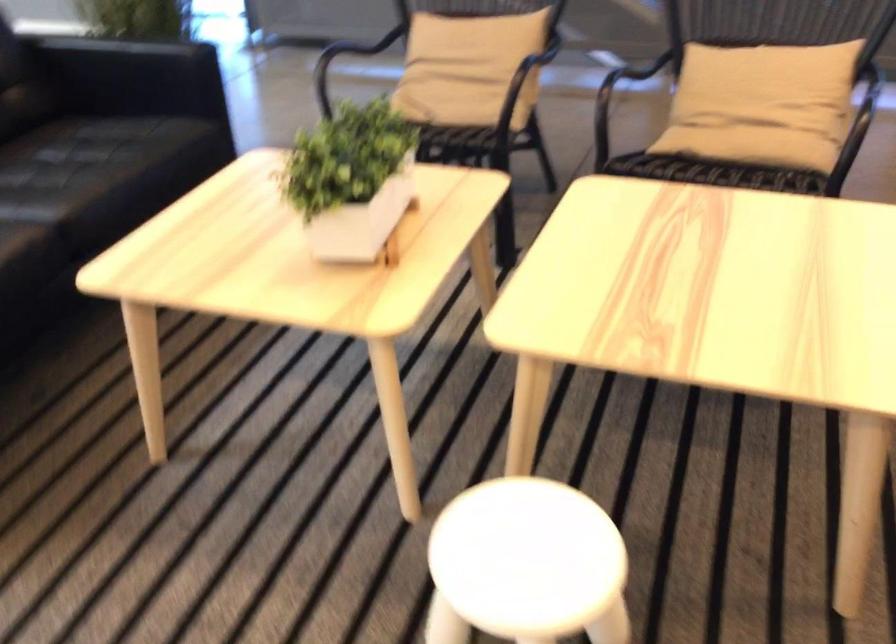
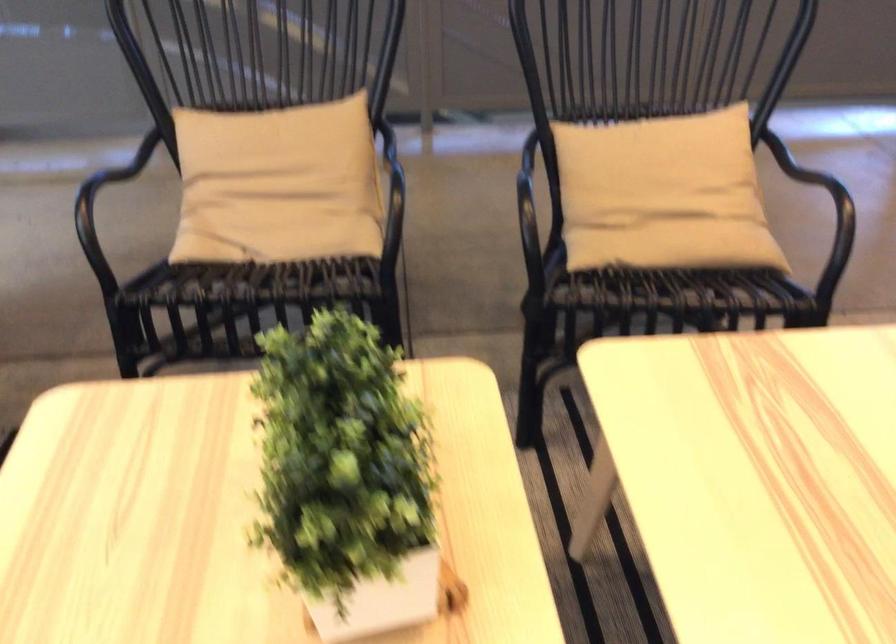
Which direction would the cameraman need to move to produce the second image?

The movement direction of the cameraman is left, forward.